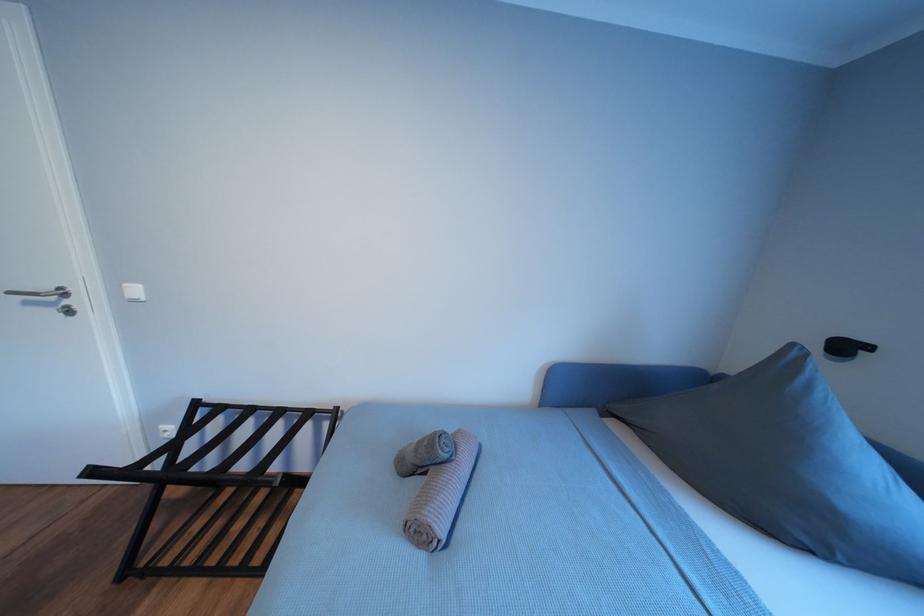
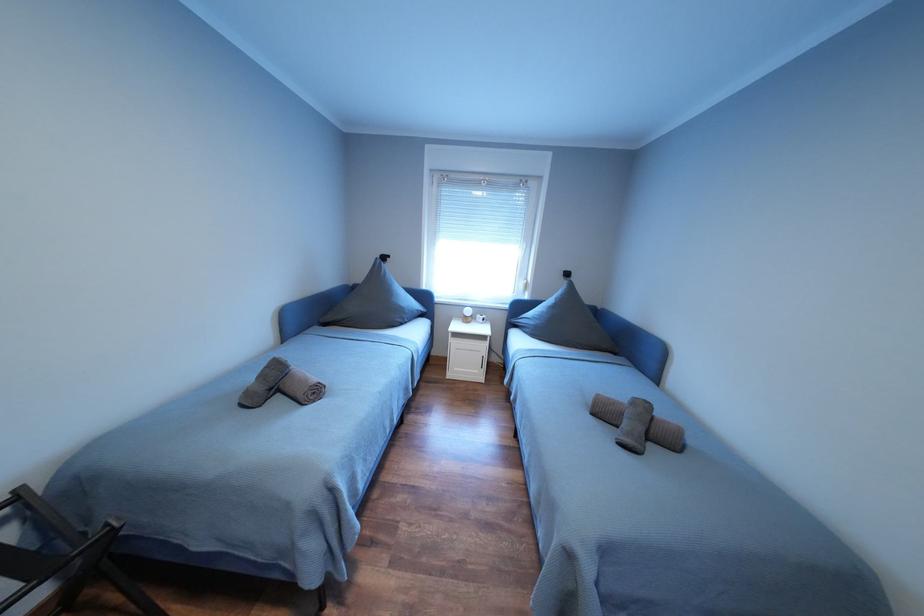
The first image is from the beginning of the video and the second image is from the end. How did the camera likely rotate when shooting the video?

The camera rotated toward right-down.